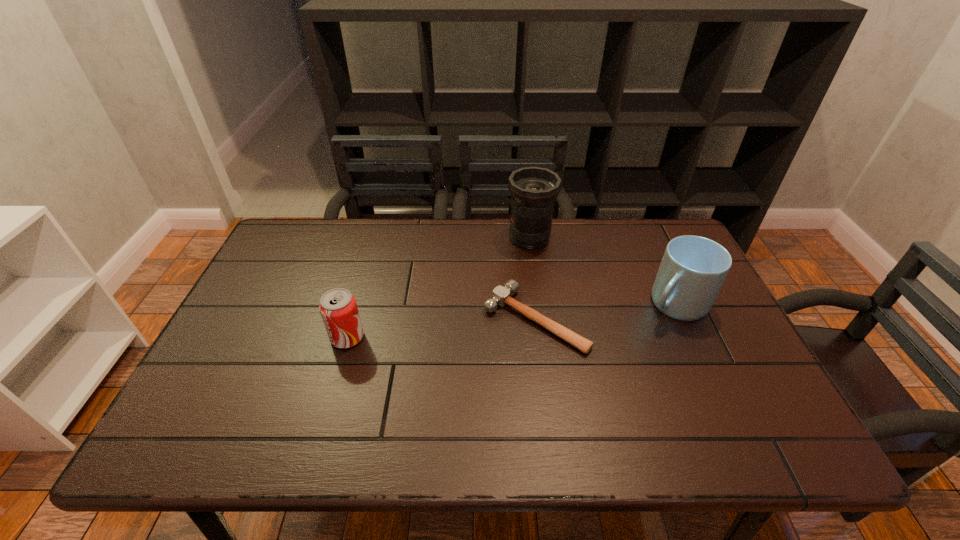
What are the coordinates of `vacant region located 0.100m on the left of the hammer` in the screenshot? It's located at (446, 319).

Image resolution: width=960 pixels, height=540 pixels. Find the location of `object located at the far edge`. object located at the far edge is located at coordinates (534, 189).

Where is `object that is at the right edge`? object that is at the right edge is located at coordinates (693, 268).

In the image, there is a desktop. Identify the location of vacant space at the far edge. The height and width of the screenshot is (540, 960). (461, 224).

Locate an element on the screen. free space at the left edge of the desktop is located at coordinates (285, 295).

The height and width of the screenshot is (540, 960). In the image, there is a desktop. Find the location of `free space at the right edge`. free space at the right edge is located at coordinates (732, 400).

Where is `vacant space at the far left corner of the desktop`? The image size is (960, 540). vacant space at the far left corner of the desktop is located at coordinates (295, 219).

Identify the location of vacant space at the far right corner of the desktop. (669, 232).

Identify the location of vacant region at the near right corner of the desktop. (763, 451).

Identify the location of empty location between the hammer and the tallest object. (532, 279).